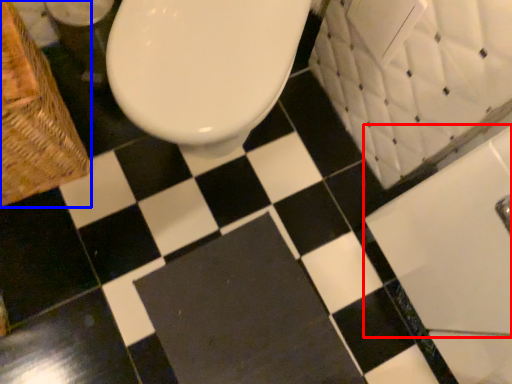
Question: Among these objects, which one is nearest to the camera, bath (highlighted by a red box) or basket (highlighted by a blue box)?

Choices:
 (A) bath
 (B) basket

Answer: (A)